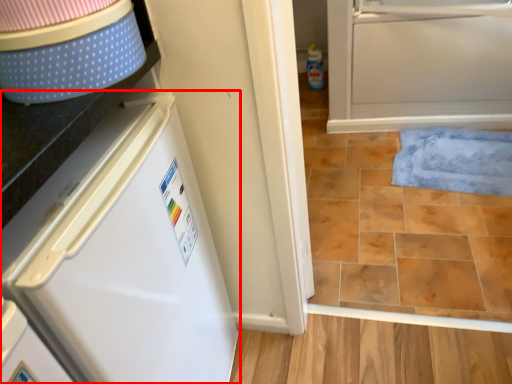
Question: Where is refrigerator (annotated by the red box) located in relation to bath mat in the image?

Choices:
 (A) left
 (B) right

Answer: (A)